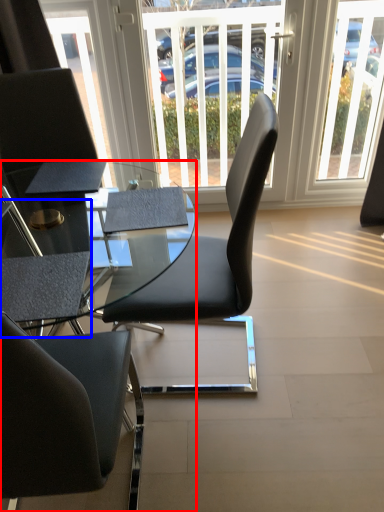
Question: Among these objects, which one is farthest to the camera, desk (highlighted by a red box) or armchair (highlighted by a blue box)?

Choices:
 (A) desk
 (B) armchair

Answer: (B)